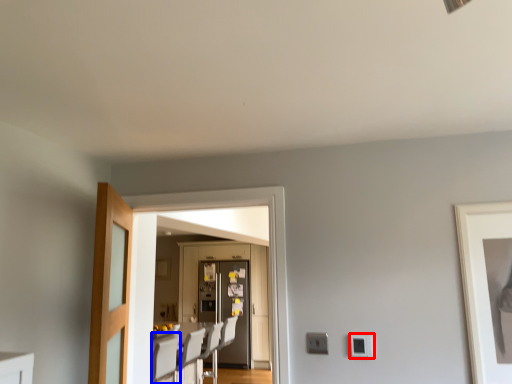
Question: Among these objects, which one is farthest to the camera, light switch (highlighted by a red box) or chair (highlighted by a blue box)?

Choices:
 (A) light switch
 (B) chair

Answer: (B)